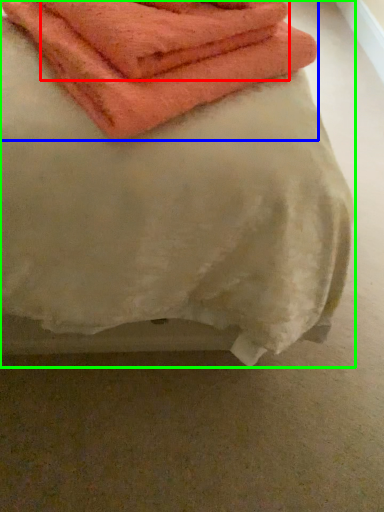
Question: Which object is positioned farthest from towel (highlighted by a red box)? Select from towel (highlighted by a blue box) and towel (highlighted by a green box).

Choices:
 (A) towel
 (B) towel

Answer: (B)